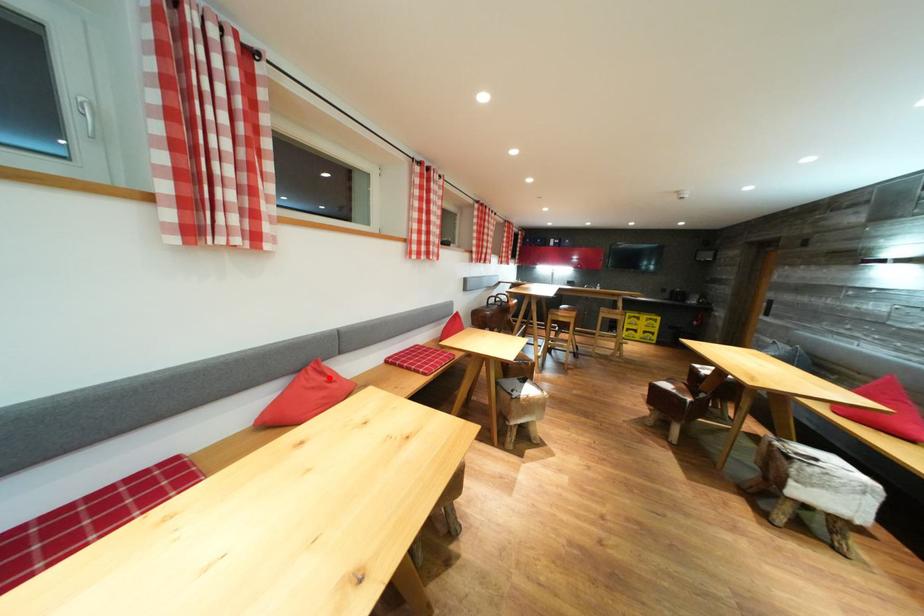
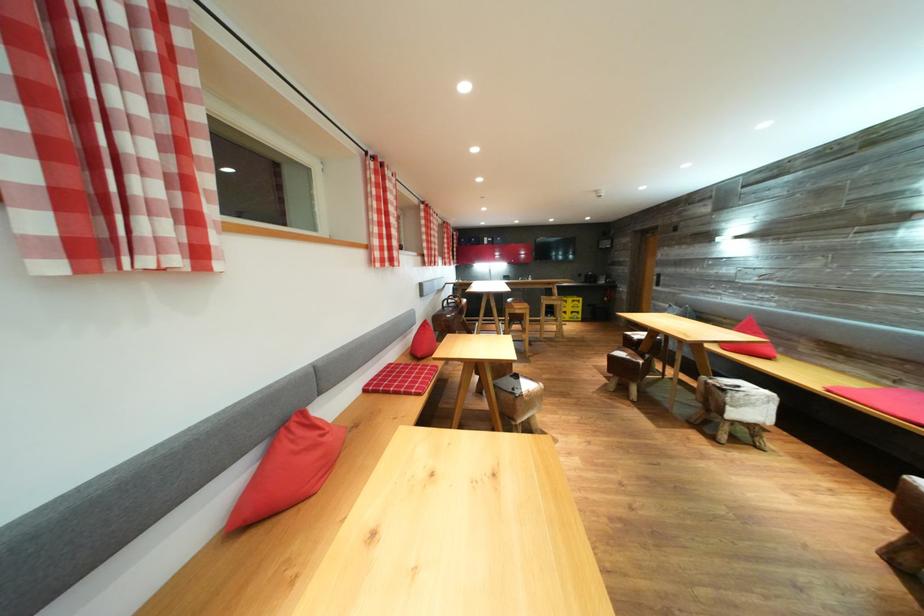
The point at the highlighted location is marked in the first image. Where is the corresponding point in the second image?

(320, 431)